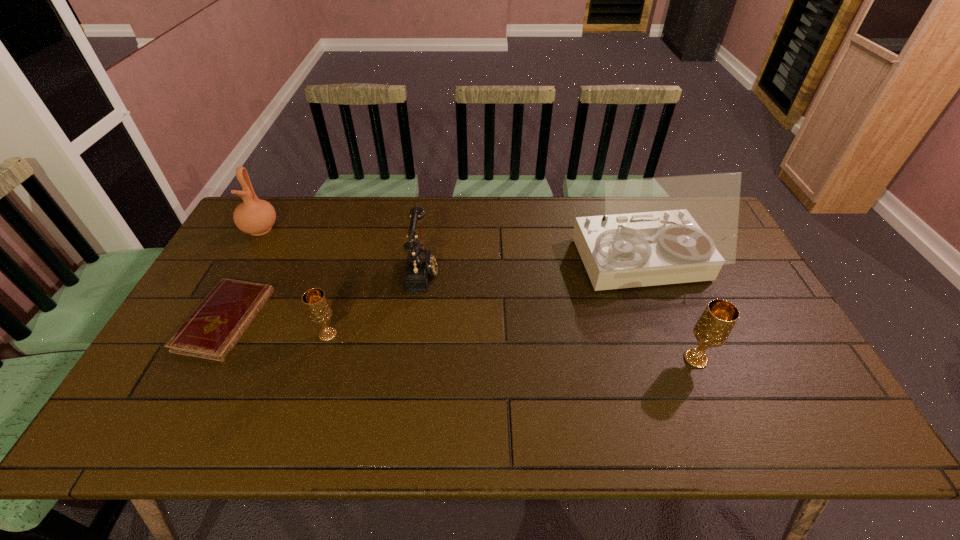
This screenshot has height=540, width=960. I want to click on object that is at the far left corner, so click(254, 216).

Image resolution: width=960 pixels, height=540 pixels. Identify the location of object present at the far right corner. (665, 230).

Where is `free region at the far edge`? The width and height of the screenshot is (960, 540). free region at the far edge is located at coordinates (407, 201).

Locate an element on the screen. vacant region at the near edge is located at coordinates (681, 374).

Find the location of a particular element. This screenshot has height=540, width=960. unoccupied position between the right chalice and the pottery is located at coordinates (478, 294).

What are the coordinates of `vacant space in between the tallest object and the telephone` in the screenshot? It's located at [x=532, y=267].

Locate an element on the screen. The height and width of the screenshot is (540, 960). vacant space in between the pottery and the nearer chalice is located at coordinates (478, 294).

Identify the location of vacant space that's between the tallest object and the second shortest object. This screenshot has height=540, width=960. (485, 299).

What are the coordinates of `vacant area between the telephone and the fourth object from right to left` in the screenshot? It's located at (375, 302).

Where is `free space between the notebook and the taller chalice`? Image resolution: width=960 pixels, height=540 pixels. free space between the notebook and the taller chalice is located at coordinates (461, 339).